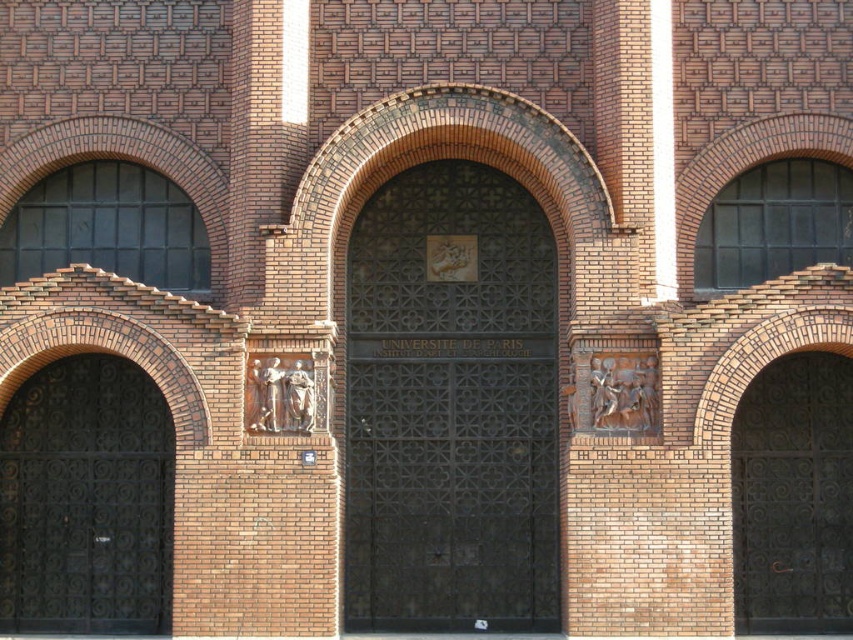
Is dark bronze gate at center shorter than black wrought iron gate at left?

In fact, dark bronze gate at center may be taller than black wrought iron gate at left.

Is dark bronze gate at center taller than black wrought iron gate at left?

Yes.

Is point (395, 262) behind point (91, 497)?

Yes, it is.

I want to click on dark bronze gate at center, so click(x=451, y=404).

Is black wrought iron gate at left below dark brown wrought iron gate at right?

Actually, black wrought iron gate at left is above dark brown wrought iron gate at right.

Can you confirm if black wrought iron gate at left is smaller than dark brown wrought iron gate at right?

Correct, black wrought iron gate at left occupies less space than dark brown wrought iron gate at right.

What do you see at coordinates (85, 500) in the screenshot? I see `black wrought iron gate at left` at bounding box center [85, 500].

The width and height of the screenshot is (853, 640). I want to click on black wrought iron gate at left, so click(x=85, y=500).

Locate an element on the screen. dark bronze gate at center is located at coordinates (451, 404).

You are a GUI agent. You are given a task and a screenshot of the screen. Output one action in this format:
    pyautogui.click(x=<x>, y=<y>)
    Task: Click on the dark bronze gate at center
    
    Given the screenshot: What is the action you would take?
    pyautogui.click(x=451, y=404)

Identify the location of dark bronze gate at center. (451, 404).